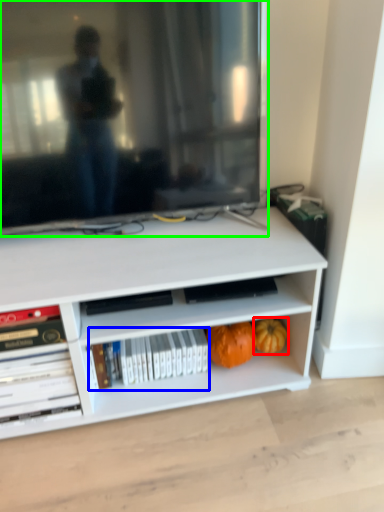
Question: Estimate the real-world distances between objects in this image. Which object is closer to pumpkin (highlighted by a red box), book (highlighted by a blue box) or television (highlighted by a green box)?

Choices:
 (A) book
 (B) television

Answer: (A)